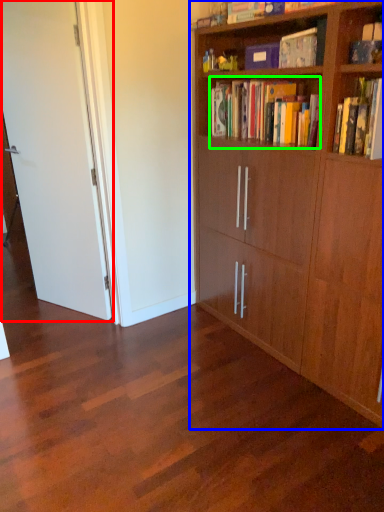
Question: Considering the real-world distances, which object is farthest from door (highlighted by a red box)? bookcase (highlighted by a blue box) or book (highlighted by a green box)?

Choices:
 (A) bookcase
 (B) book

Answer: (B)